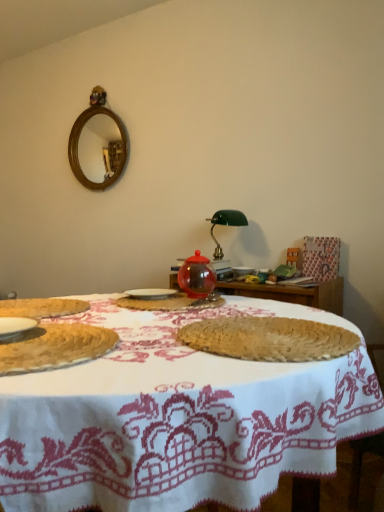
The height and width of the screenshot is (512, 384). What are the coordinates of `free region on the left part of braided straw placemat at center, arranged as the second food when viewed from the front` in the screenshot? It's located at (140, 330).